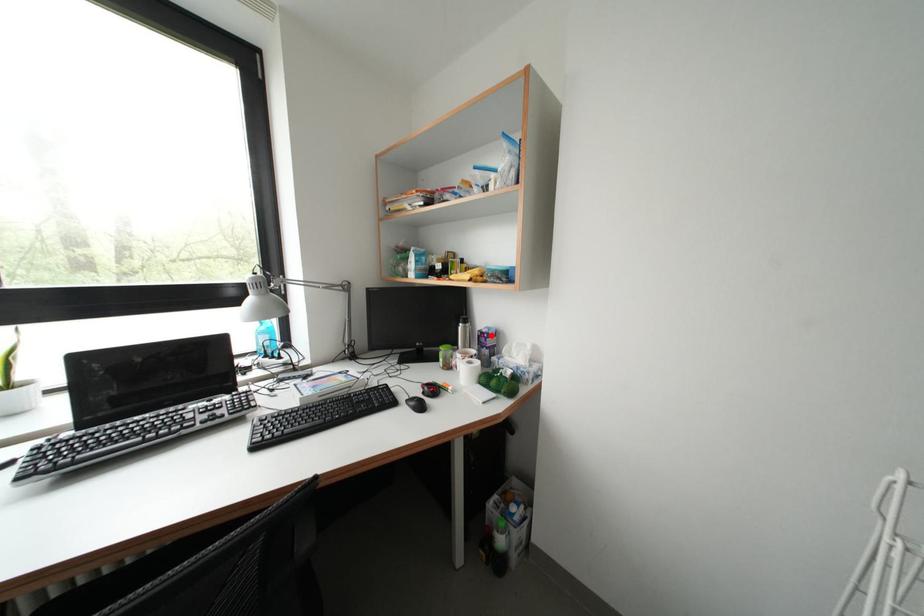
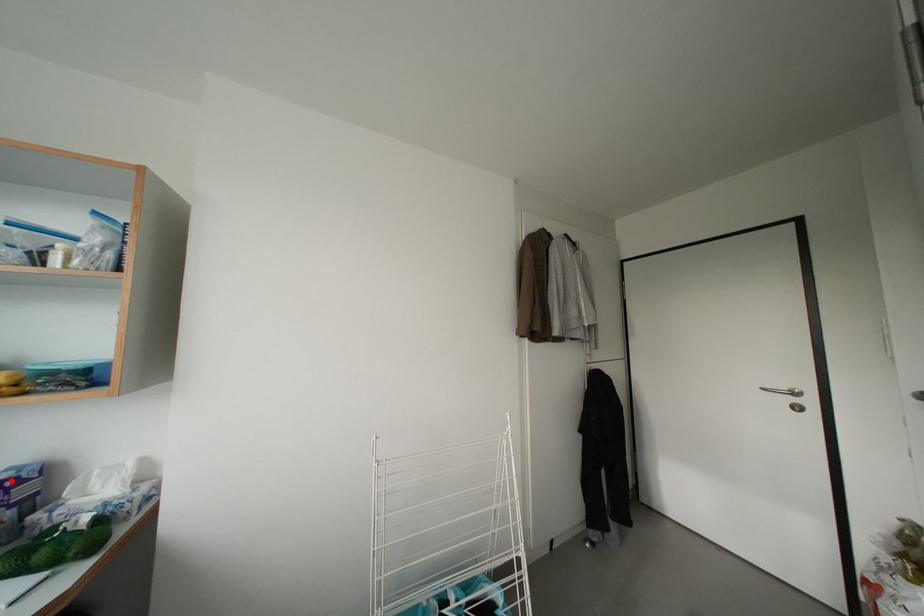
I am providing you with two images of the same scene from different viewpoints. A red point is marked on the first image and another point is marked on the second image. Does the point marked in image1 correspond to the same location as the one in image2?

Yes